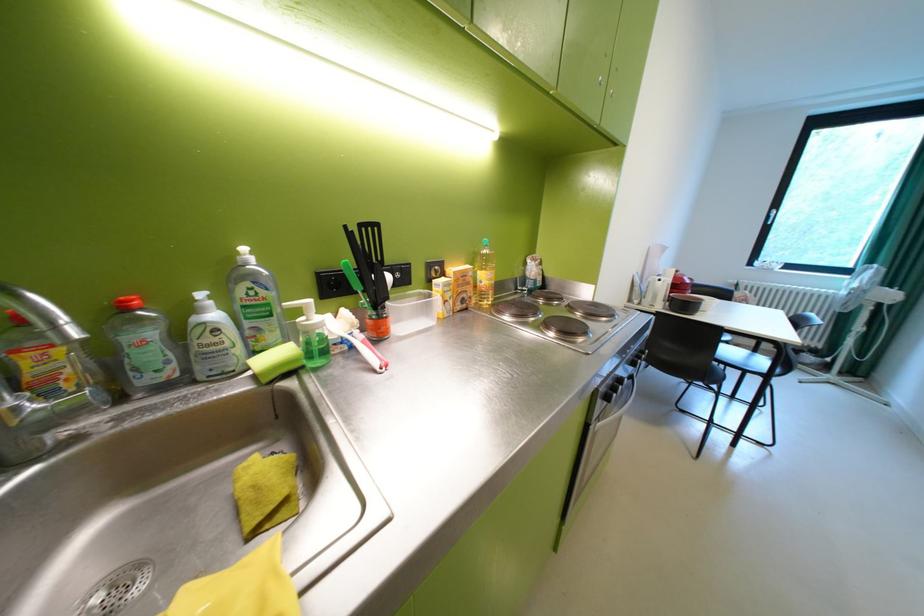
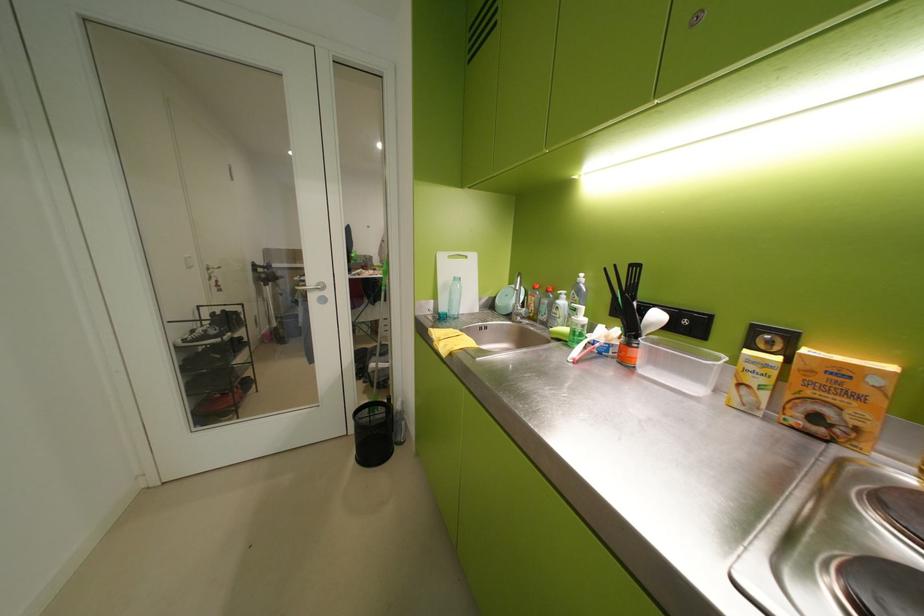
Where in the second image is the point corresponding to point (457, 285) from the first image?

(773, 365)